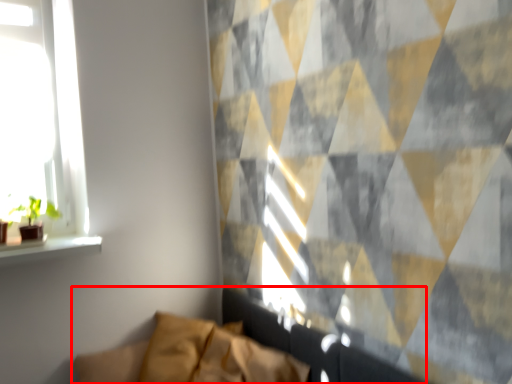
Question: Where is couch (annotated by the red box) located in relation to houseplant in the image?

Choices:
 (A) right
 (B) left

Answer: (A)